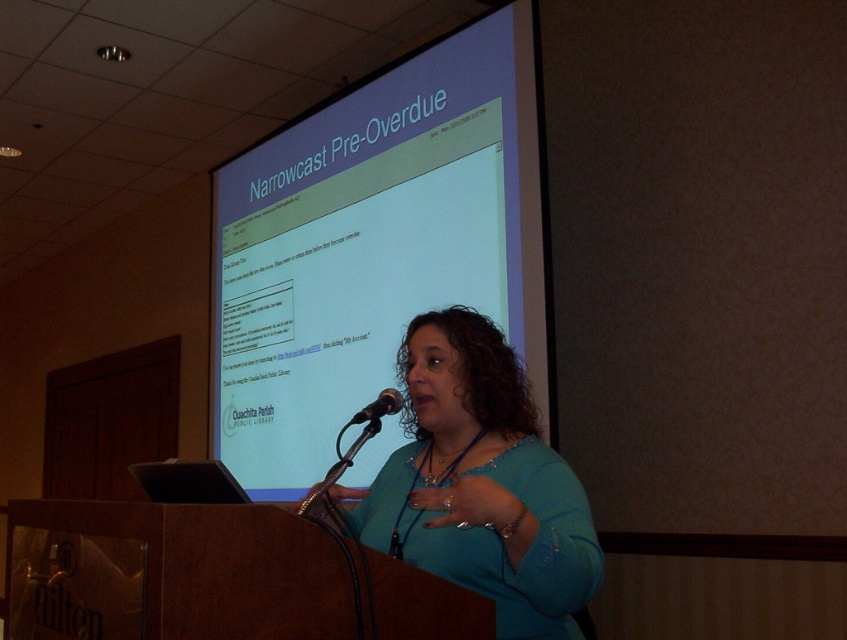
Question: Which object is closer to the camera taking this photo?

Choices:
 (A) black metallic microphone at center
 (B) matte white projector screen at upper center
 (C) teal fabric shirt at center

Answer: (C)

Question: Is matte white projector screen at upper center behind black metallic microphone at center?

Choices:
 (A) no
 (B) yes

Answer: (B)

Question: Can you confirm if matte white projector screen at upper center is positioned to the right of teal fabric shirt at center?

Choices:
 (A) no
 (B) yes

Answer: (A)

Question: Which object appears farthest from the camera in this image?

Choices:
 (A) matte white projector screen at upper center
 (B) teal fabric shirt at center
 (C) black metallic microphone at center

Answer: (A)

Question: Which object appears closest to the camera in this image?

Choices:
 (A) teal fabric shirt at center
 (B) matte white projector screen at upper center

Answer: (A)

Question: Is teal fabric shirt at center closer to camera compared to black metallic microphone at center?

Choices:
 (A) no
 (B) yes

Answer: (B)